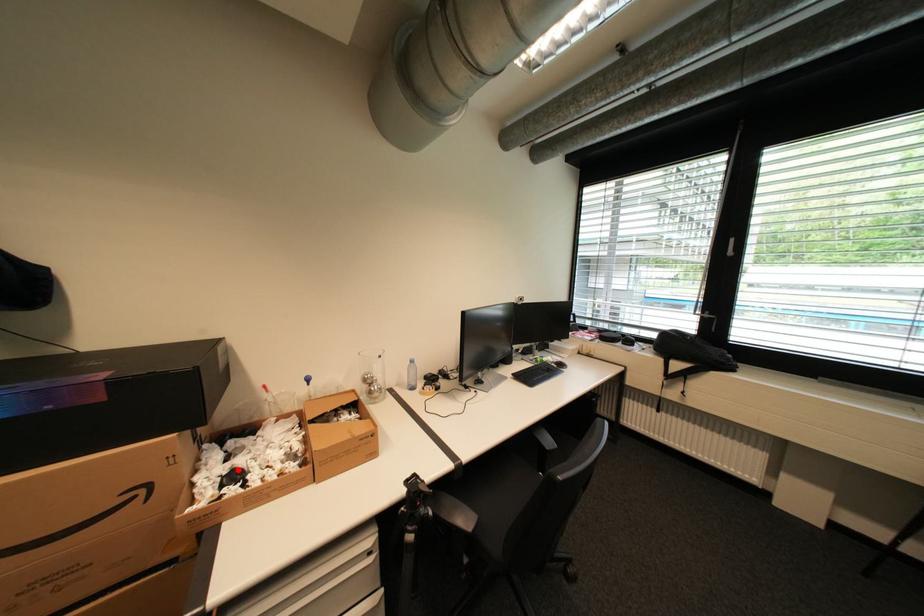
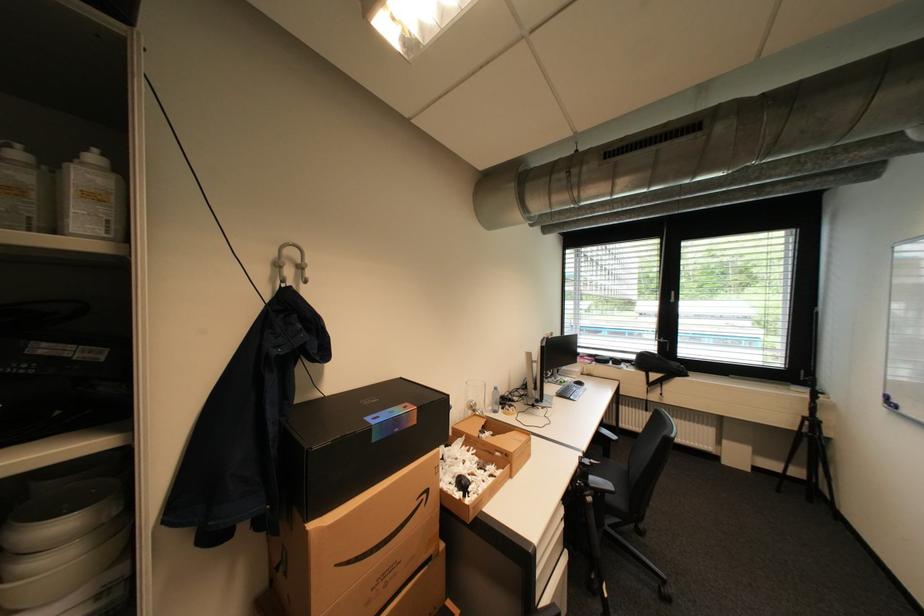
Find the pixel in the second image that matches the highlighted location in the first image.

(462, 477)